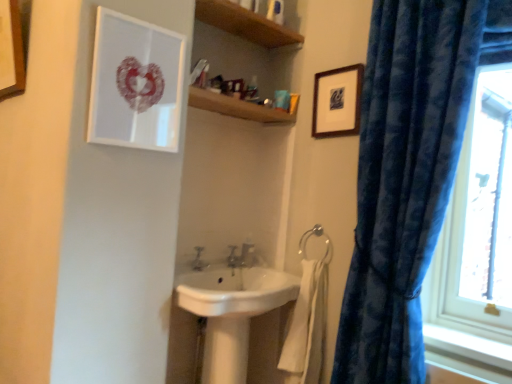
Question: Is wooden shelf at upper center at the back of white glossy sink at center?

Choices:
 (A) yes
 (B) no

Answer: (B)

Question: Is white glossy sink at center positioned before wooden shelf at upper center?

Choices:
 (A) no
 (B) yes

Answer: (B)

Question: Can you confirm if white glossy sink at center is positioned to the left of wooden shelf at upper center?

Choices:
 (A) yes
 (B) no

Answer: (B)

Question: Can you confirm if white glossy sink at center is shorter than wooden shelf at upper center?

Choices:
 (A) no
 (B) yes

Answer: (B)

Question: From the image's perspective, is white glossy sink at center located beneath wooden shelf at upper center?

Choices:
 (A) yes
 (B) no

Answer: (A)

Question: Is white glossy sink at center taller than wooden shelf at upper center?

Choices:
 (A) yes
 (B) no

Answer: (B)

Question: Considering the relative positions of white cotton bath towel at lower center and wooden picture frame at upper left, marked as the third picture frame in a right-to-left arrangement, in the image provided, is white cotton bath towel at lower center to the right of wooden picture frame at upper left, marked as the third picture frame in a right-to-left arrangement, from the viewer's perspective?

Choices:
 (A) no
 (B) yes

Answer: (B)

Question: Is white cotton bath towel at lower center wider than wooden picture frame at upper left, acting as the 1th picture frame starting from the left?

Choices:
 (A) yes
 (B) no

Answer: (A)

Question: Does white cotton bath towel at lower center lie behind wooden picture frame at upper left, marked as the third picture frame in a right-to-left arrangement?

Choices:
 (A) no
 (B) yes

Answer: (B)

Question: Does white cotton bath towel at lower center have a lesser width compared to wooden picture frame at upper left, marked as the third picture frame in a right-to-left arrangement?

Choices:
 (A) yes
 (B) no

Answer: (B)

Question: Can you confirm if white cotton bath towel at lower center is positioned to the left of wooden picture frame at upper left, marked as the third picture frame in a right-to-left arrangement?

Choices:
 (A) yes
 (B) no

Answer: (B)

Question: Does white cotton bath towel at lower center have a lesser height compared to wooden picture frame at upper left, marked as the third picture frame in a right-to-left arrangement?

Choices:
 (A) yes
 (B) no

Answer: (B)

Question: From a real-world perspective, is wooden picture frame at upper right, which appears as the 1th picture frame when viewed from the right, below matte white picture frame at upper left, which is counted as the 2th picture frame, starting from the right?

Choices:
 (A) no
 (B) yes

Answer: (A)